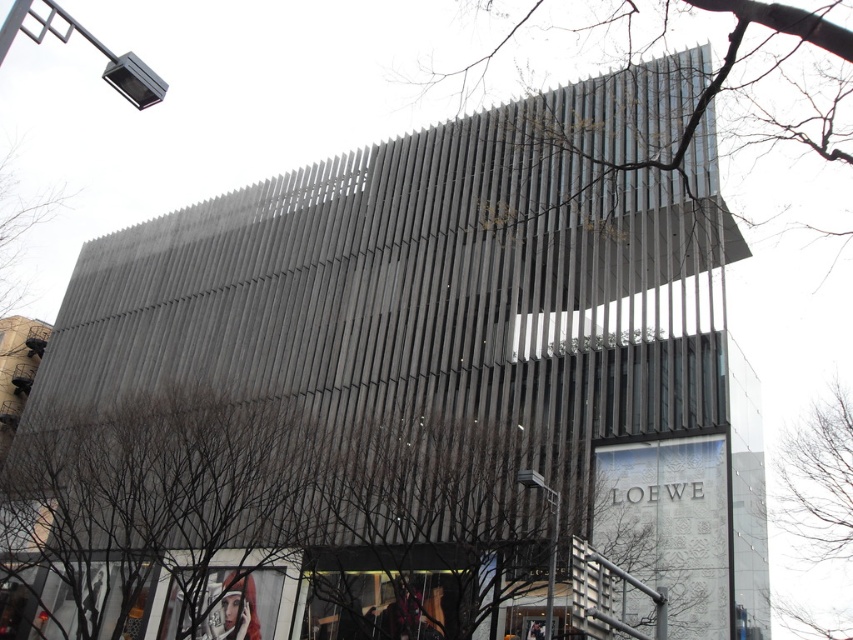
Based on the photo, you are standing in front of the modern building and want to take a photo of the bare branches at upper center. Where should you position yourself to capture the branches in the center of your camera viewfinder?

To capture the bare branches at upper center in the center of your camera viewfinder, position yourself directly in front of the building at the point corresponding to the coordinates mentioned in the description, which is at 0.072 on the x axis and 0.787 on the y axis.

You are standing in front of the modern building and notice two sets of bare branches. One is labeled as bare branches at upper center and the other as bare branches at right. Which of these two is positioned more to the left side of the building?

The bare branches at upper center are positioned more to the left side of the building compared to the bare branches at right.

From the picture: You are standing in front of the modern building and notice two sets of bare branches in the scene. Which set of bare branches, the bare branches at upper center or the bare branches at right, is closer to you?

The bare branches at upper center is closer to you because it is in front of the bare branches at right.